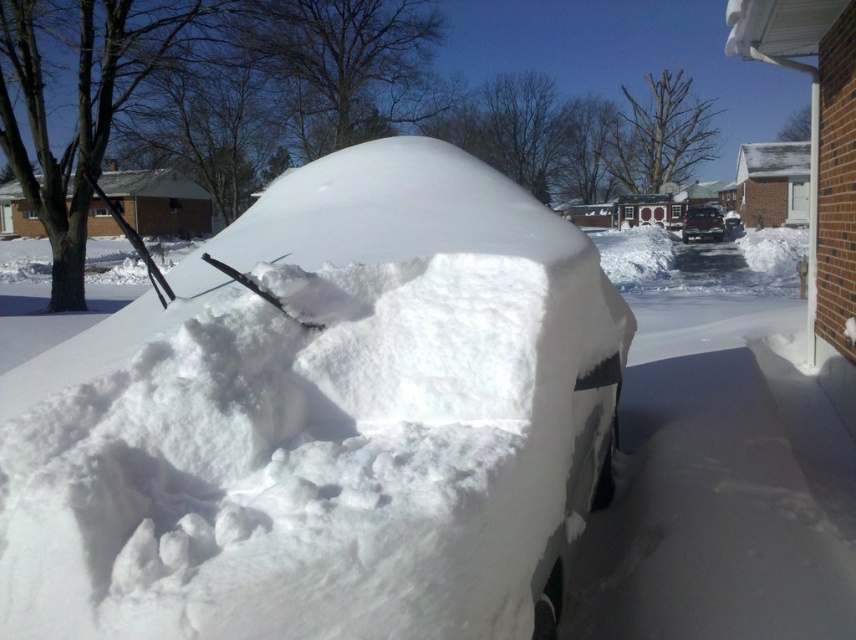
You are standing at the center of the snowy scene. There is a point marked at coordinates (324, 420). What is located at this point?

The white fluffy snow at center is located at point (324, 420).

You are standing in the snowy scene looking at the car. There are two points marked on the car. One is at coordinate point (156, 400) and the other at point (714, 236). Which point is closer to you?

Point (156, 400) is closer to the camera than point (714, 236).

You are standing at the edge of the driveway and see the white fluffy snow at center and the black glossy suv at center. Which object is positioned to the right?

The black glossy suv at center is positioned to the right of the white fluffy snow at center.